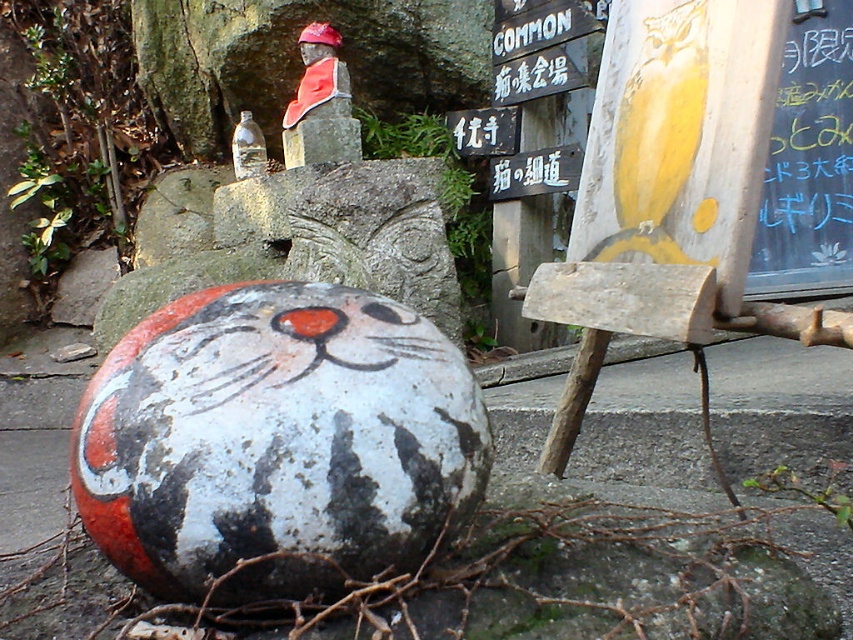
You are a visitor at this shrine and want to take a photo of both the painted stone cat at lower left and the wooden signboard at upper center in the same frame. Given their sizes, which object will appear bigger in the photo?

The painted stone cat at lower left will appear bigger in the photo because it is larger in size than the wooden signboard at upper center.

You are a visitor approaching the shrine and want to read both the wooden signboard at upper center and the metallic signboard at center. Which signboard should you look at first to read both without moving your head much?

You should look at the wooden signboard at upper center first since it is in front of the metallic signboard at center, so you can read it without moving your head much before adjusting your gaze to the one behind.